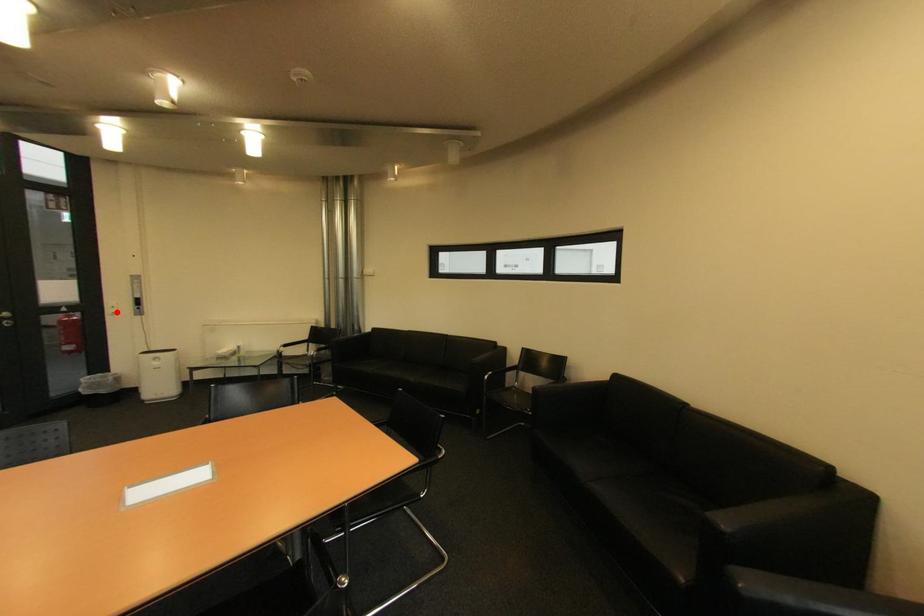
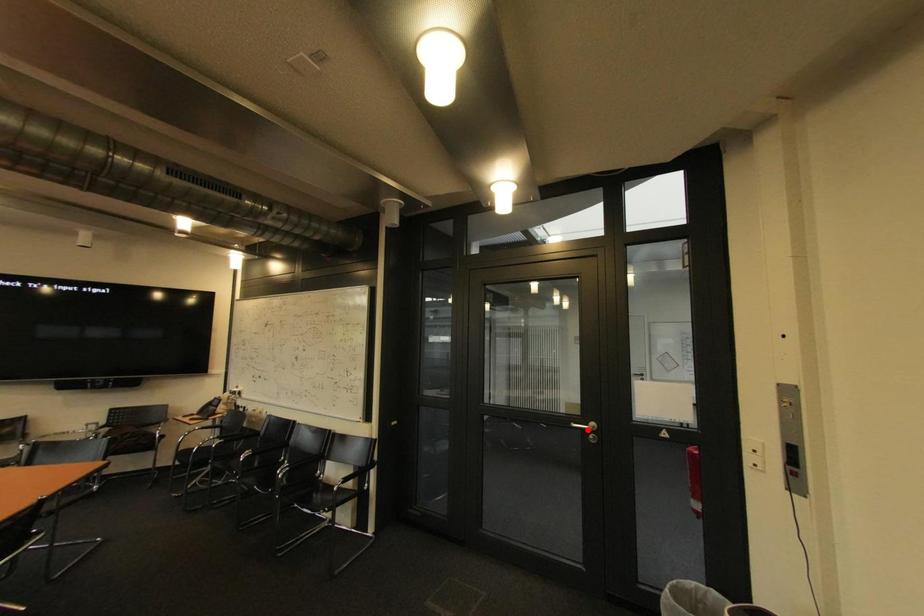
I am providing you with two images of the same scene from different viewpoints. A red point is marked on the first image and another point is marked on the second image. Is the marked point in image1 the same physical position as the marked point in image2?

No